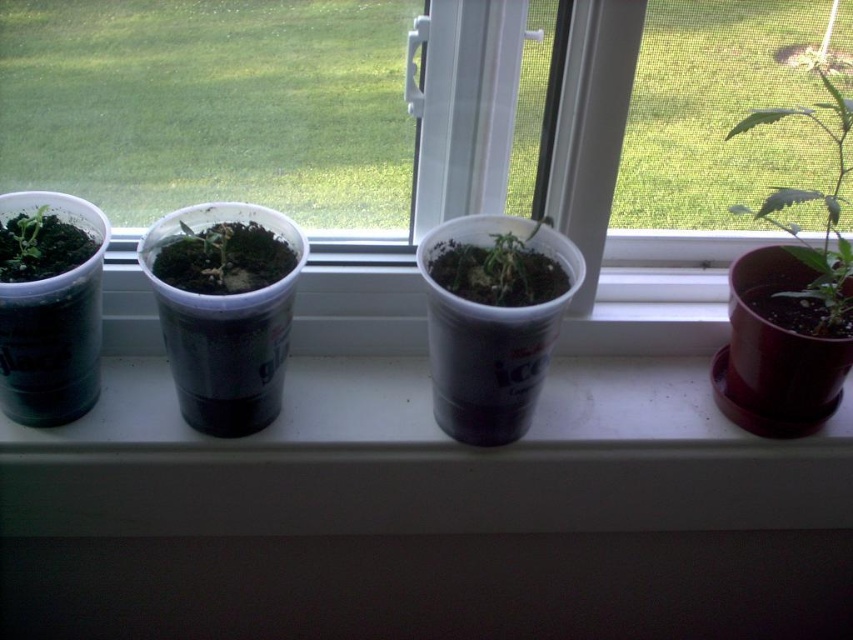
Question: Which point is closer to the camera?

Choices:
 (A) (73, 257)
 (B) (825, 72)
 (C) (676, 118)
 (D) (172, 248)

Answer: (A)

Question: Can you confirm if transparent plastic cups at center is bigger than green matte plastic cup at left?

Choices:
 (A) no
 (B) yes

Answer: (B)

Question: Estimate the real-world distances between objects in this image. Which object is farther from the green matte plastic cup at left?

Choices:
 (A) white plastic cups at center
 (B) green matte plant at right

Answer: (B)

Question: Based on their relative distances, which object is farther from the white plastic cups at center?

Choices:
 (A) green matte plastic cup at left
 (B) green matte plastic cup at center
 (C) transparent plastic cups at center
 (D) green matte plant at right

Answer: (A)

Question: Can you confirm if transparent plastic cups at center is positioned to the left of green matte plastic cup at left?

Choices:
 (A) no
 (B) yes

Answer: (A)

Question: Can you confirm if white plastic cups at center is positioned above green matte plastic cup at left?

Choices:
 (A) no
 (B) yes

Answer: (A)